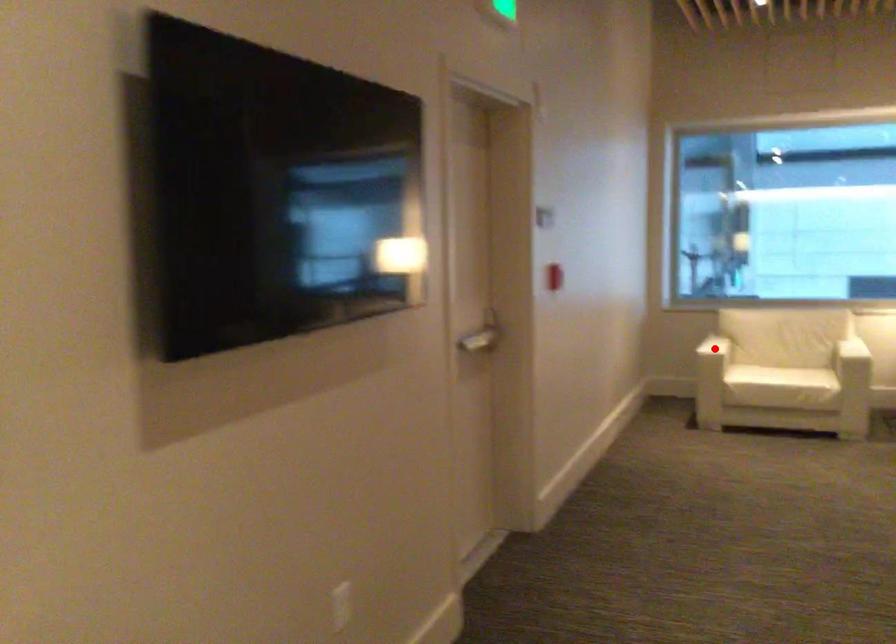
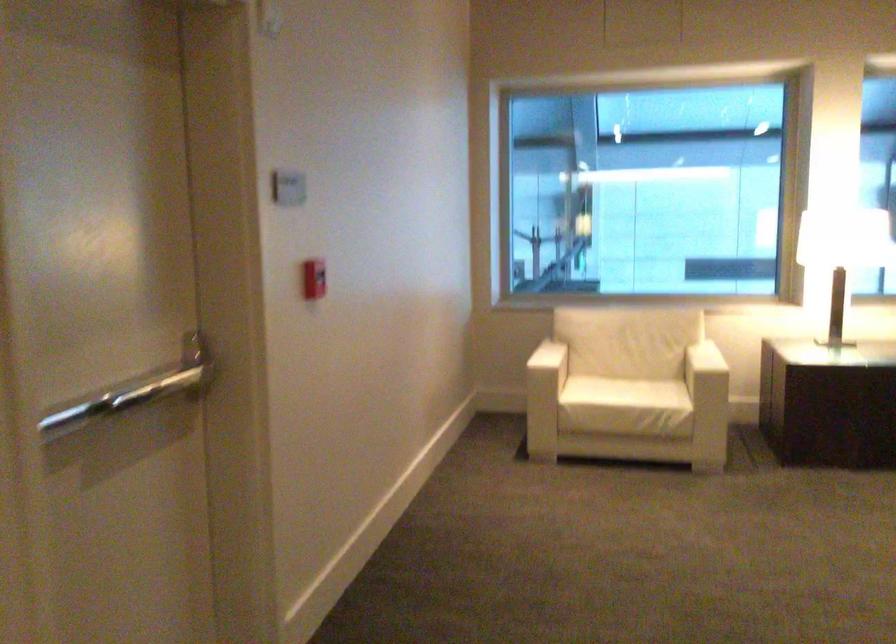
The point at the highlighted location is marked in the first image. Where is the corresponding point in the second image?

(536, 377)